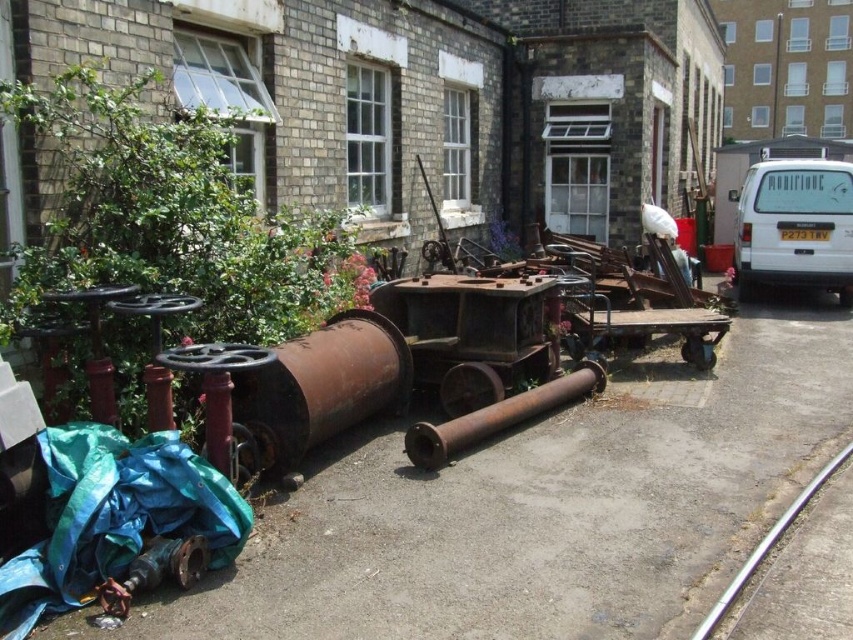
You are a worker who needs to move the blue tarpaulin at lower left and the rusty metal pipe at center to the storage area. Which object should you move first if you want to start with the one closer to the storage entrance located at the far right of the image?

The blue tarpaulin at lower left should be moved first because it is closer to the storage entrance at the far right compared to the rusty metal pipe at center, which is positioned to the left of it.

You are standing in front of the brick building and want to move from the blue tarpaulin at lower left to the white matte van at upper right. Which direction should you walk to get closer to the van?

You should walk towards the upper right direction to get closer to the white matte van at upper right since it is located in that direction and the blue tarpaulin at lower left is closer to you initially.

You are standing at the entrance of the brick building and want to cover a pile of metal objects with the blue tarpaulin at lower left. Based on its position, will the tarpaulin be placed to the left or right of the entrance?

The blue tarpaulin at lower left is located at point (114,516), which means it is positioned to the left side of the entrance. Therefore, placing the tarpaulin there would cover the metal objects on the left side of the entrance.